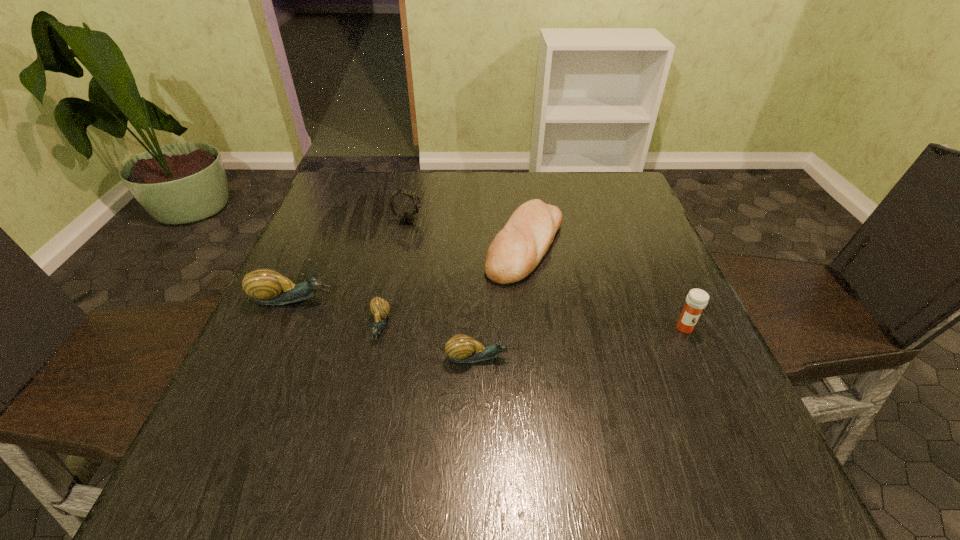
Locate an element on the screen. vacant space at the near edge is located at coordinates (403, 421).

I want to click on free space at the left edge, so click(x=363, y=239).

Where is `free space at the right edge of the desktop`? The height and width of the screenshot is (540, 960). free space at the right edge of the desktop is located at coordinates (625, 260).

Locate an element on the screen. This screenshot has width=960, height=540. free space at the far left corner of the desktop is located at coordinates (348, 211).

Where is `vacant space at the far right corner`? The width and height of the screenshot is (960, 540). vacant space at the far right corner is located at coordinates (588, 187).

Find the location of `unoccupied area between the bread and the leftmost object`. unoccupied area between the bread and the leftmost object is located at coordinates (409, 272).

The width and height of the screenshot is (960, 540). In order to click on free spot between the second shortest escargot and the bread in this screenshot , I will do `click(502, 301)`.

Locate an element on the screen. The height and width of the screenshot is (540, 960). vacant region between the watch and the second escargot from right to left is located at coordinates (394, 274).

Locate an element on the screen. This screenshot has width=960, height=540. free spot between the rightmost object and the shortest escargot is located at coordinates (532, 327).

Where is `vacant area between the medicine and the tallest escargot`? vacant area between the medicine and the tallest escargot is located at coordinates (489, 314).